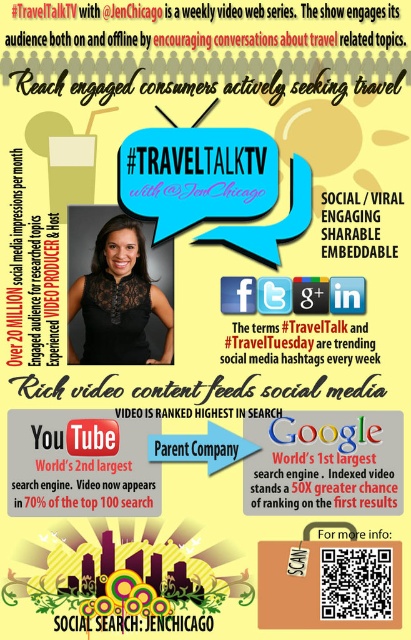
Question: Which of the following is the closest to the observer?

Choices:
 (A) gold metallic text at center
 (B) black text at center
 (C) whitetextured papersign at upper right

Answer: (A)

Question: From the image, what is the correct spatial relationship of black lace dress at center in relation to gold metallic text at center?

Choices:
 (A) above
 (B) below

Answer: (A)

Question: Among these objects, which one is nearest to the camera?

Choices:
 (A) whitetextured papersign at upper right
 (B) gold metallic text at center
 (C) black text at center

Answer: (B)

Question: Is gold metallic text at center thinner than whitetextured papersign at upper right?

Choices:
 (A) no
 (B) yes

Answer: (A)

Question: Estimate the real-world distances between objects in this image. Which object is farther from the black lace dress at center?

Choices:
 (A) gold metallic text at center
 (B) black text at center
 (C) whitetextured papersign at upper right

Answer: (C)

Question: Can you confirm if gold metallic text at center is thinner than black text at center?

Choices:
 (A) yes
 (B) no

Answer: (B)